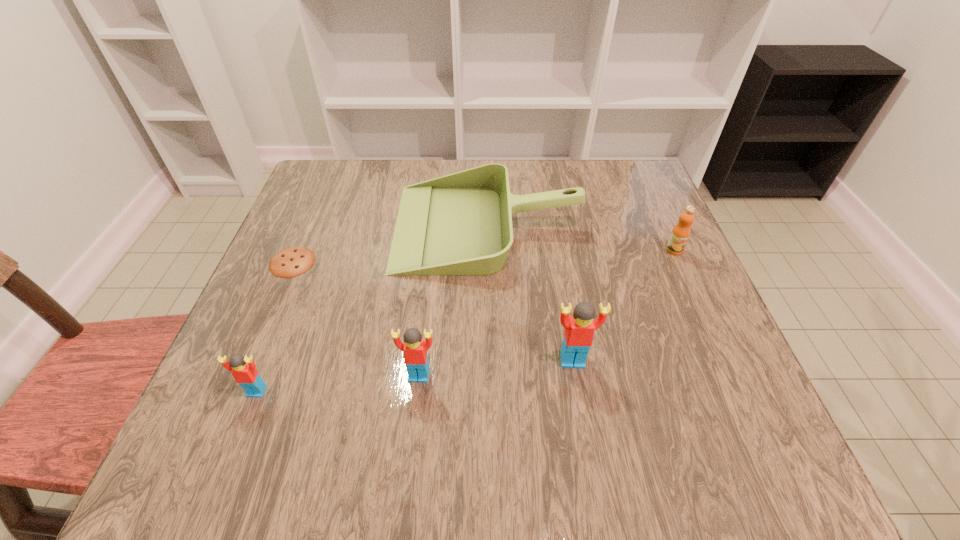
The width and height of the screenshot is (960, 540). I want to click on vacant area that lies between the dustpan and the second Lego from left to right, so click(x=453, y=301).

You are a GUI agent. You are given a task and a screenshot of the screen. Output one action in this format:
    pyautogui.click(x=<x>, y=<y>)
    Task: Click on the free space between the rightmost Lego and the cookie
    This screenshot has width=960, height=540.
    Given the screenshot: What is the action you would take?
    pyautogui.click(x=432, y=311)

At what (x,y) coordinates should I click in order to perform the action: click on free spot between the rightmost object and the dustpan. Please return your answer as a coordinate pair (x, y). Looking at the image, I should click on (581, 238).

You are a GUI agent. You are given a task and a screenshot of the screen. Output one action in this format:
    pyautogui.click(x=<x>, y=<y>)
    Task: Click on the blank region between the second Lego from right to left and the shortest Lego
    The image size is (960, 540).
    Given the screenshot: What is the action you would take?
    pyautogui.click(x=338, y=383)

Find the location of a particular element. The width and height of the screenshot is (960, 540). object that is the fifth closest one to the second Lego from left to right is located at coordinates (680, 234).

Select which object is the second closest to the second shortest Lego. Please provide its 2D coordinates. Your answer should be formatted as a tuple, i.e. [(x, y)], where the tuple contains the x and y coordinates of a point satisfying the conditions above.

[(244, 371)]

At what (x,y) coordinates should I click in order to perform the action: click on Lego that is the second closest one to the second tallest Lego. Please return your answer as a coordinate pair (x, y). The image size is (960, 540). Looking at the image, I should click on (244, 371).

Where is `Lego identified as the second closest to the shortest Lego`? Lego identified as the second closest to the shortest Lego is located at coordinates (579, 329).